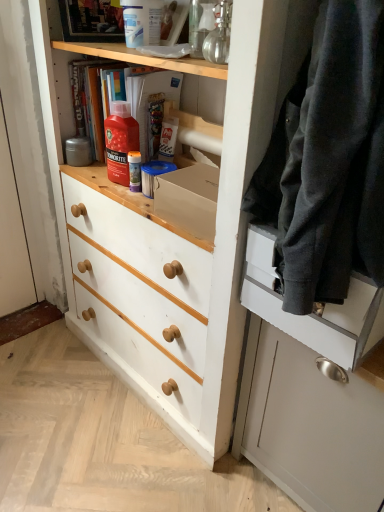
Find the location of a particular element. The width and height of the screenshot is (384, 512). red glossy bottle at upper center is located at coordinates (120, 141).

Does dark gray wool sweater at right have a greater height compared to satin white cabinet at right?

No, dark gray wool sweater at right is not taller than satin white cabinet at right.

Is dark gray wool sweater at right next to satin white cabinet at right and touching it?

No, dark gray wool sweater at right is not touching satin white cabinet at right.

Is dark gray wool sweater at right facing away from satin white cabinet at right?

No, satin white cabinet at right is not at the back of dark gray wool sweater at right.

Is dark gray wool sweater at right outside of satin white cabinet at right?

Yes.

Would you say white painted wood chest of drawers at center is outside satin white cabinet at right?

Yes, white painted wood chest of drawers at center is outside of satin white cabinet at right.

From the picture: From the image's perspective, is white painted wood chest of drawers at center located above satin white cabinet at right?

Yes, from the image's perspective, white painted wood chest of drawers at center is above satin white cabinet at right.

Considering the positions of objects white painted wood chest of drawers at center and satin white cabinet at right in the image provided, who is more to the left, white painted wood chest of drawers at center or satin white cabinet at right?

white painted wood chest of drawers at center.

At what (x,y) coordinates should I click in order to perform the action: click on cabinetry behind the white painted wood chest of drawers at center. Please return your answer as a coordinate pair (x, y). The width and height of the screenshot is (384, 512). Looking at the image, I should click on (311, 390).

Visually, is white painted wood chest of drawers at center positioned to the left or to the right of dark gray wool sweater at right?

Based on their positions, white painted wood chest of drawers at center is located to the left of dark gray wool sweater at right.

Could you tell me if white painted wood chest of drawers at center is facing dark gray wool sweater at right?

No.

From the image's perspective, would you say white painted wood chest of drawers at center is positioned over dark gray wool sweater at right?

No.

Who is shorter, white painted wood chest of drawers at center or dark gray wool sweater at right?

With less height is dark gray wool sweater at right.

Which object is positioned more to the right, satin white cabinet at right or matte black drawer at right?

From the viewer's perspective, satin white cabinet at right appears more on the right side.

Is satin white cabinet at right completely or partially outside of matte black drawer at right?

Absolutely, satin white cabinet at right is external to matte black drawer at right.

How far apart are satin white cabinet at right and matte black drawer at right?

satin white cabinet at right is 5.41 inches away from matte black drawer at right.

Considering the relative sizes of satin white cabinet at right and matte black drawer at right in the image provided, is satin white cabinet at right bigger than matte black drawer at right?

Yes.

Could dark gray wool sweater at right be considered to be inside satin white cabinet at right?

No, satin white cabinet at right does not contain dark gray wool sweater at right.

This screenshot has height=512, width=384. I want to click on clothing above the satin white cabinet at right (from the image's perspective), so click(335, 159).

Does satin white cabinet at right touch dark gray wool sweater at right?

No, satin white cabinet at right is not beside dark gray wool sweater at right.

In the image, is matte black drawer at right on the left side or the right side of dark gray wool sweater at right?

matte black drawer at right is positioned on dark gray wool sweater at right's right side.

Considering the relative sizes of matte black drawer at right and dark gray wool sweater at right in the image provided, is matte black drawer at right shorter than dark gray wool sweater at right?

Yes.

Can you confirm if matte black drawer at right is thinner than dark gray wool sweater at right?

Yes, matte black drawer at right is thinner than dark gray wool sweater at right.

Considering the relative sizes of dark gray wool sweater at right and white painted wood chest of drawers at center in the image provided, is dark gray wool sweater at right taller than white painted wood chest of drawers at center?

In fact, dark gray wool sweater at right may be shorter than white painted wood chest of drawers at center.

Is dark gray wool sweater at right behind white painted wood chest of drawers at center?

No, dark gray wool sweater at right is closer to the camera.

The width and height of the screenshot is (384, 512). I want to click on cabinetry located behind the dark gray wool sweater at right, so click(311, 390).

Find the location of a particular element. the chest of drawers lying above the satin white cabinet at right (from the image's perspective) is located at coordinates (171, 248).

Which object lies nearer to the anchor point dark gray wool sweater at right, satin white cabinet at right or red glossy bottle at upper center?

Based on the image, satin white cabinet at right appears to be nearer to dark gray wool sweater at right.

Estimate the real-world distances between objects in this image. Which object is closer to matte black drawer at right, satin white cabinet at right or white painted wood chest of drawers at center?

satin white cabinet at right is positioned closer to the anchor matte black drawer at right.

Looking at the image, which one is located closer to white painted wood chest of drawers at center, red glossy bottle at upper center or dark gray wool sweater at right?

red glossy bottle at upper center lies closer to white painted wood chest of drawers at center than the other object.

Which object lies nearer to the anchor point red glossy bottle at upper center, matte black drawer at right or dark gray wool sweater at right?

Based on the image, matte black drawer at right appears to be nearer to red glossy bottle at upper center.

Estimate the real-world distances between objects in this image. Which object is further from red glossy bottle at upper center, white painted wood chest of drawers at center or dark gray wool sweater at right?

dark gray wool sweater at right.

Based on their spatial positions, is dark gray wool sweater at right or matte black drawer at right closer to satin white cabinet at right?

Based on the image, matte black drawer at right appears to be nearer to satin white cabinet at right.

When comparing their distances from dark gray wool sweater at right, does satin white cabinet at right or matte black drawer at right seem further?

Based on the image, satin white cabinet at right appears to be further to dark gray wool sweater at right.

From the image, which object appears to be farther from red glossy bottle at upper center, matte black drawer at right or white painted wood chest of drawers at center?

matte black drawer at right lies further to red glossy bottle at upper center than the other object.

This screenshot has height=512, width=384. What are the coordinates of `drawer between dark gray wool sweater at right and satin white cabinet at right in the up-down direction` in the screenshot? It's located at (316, 312).

The height and width of the screenshot is (512, 384). What are the coordinates of `chest of drawers between red glossy bottle at upper center and matte black drawer at right from left to right` in the screenshot? It's located at (171, 248).

Locate an element on the screen. The height and width of the screenshot is (512, 384). drawer between dark gray wool sweater at right and red glossy bottle at upper center from front to back is located at coordinates 316,312.

Find the location of a particular element. clothing between red glossy bottle at upper center and satin white cabinet at right in the up-down direction is located at coordinates [x=335, y=159].